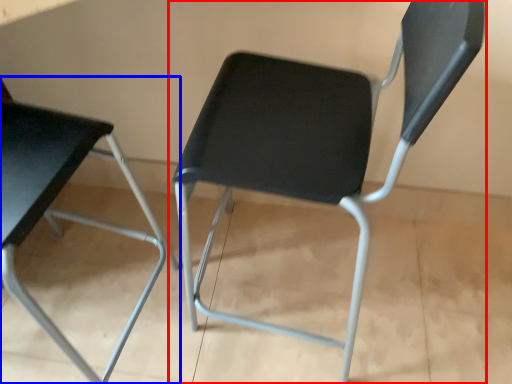
Question: Which of the following is the closest to the observer, chair (highlighted by a red box) or chair (highlighted by a blue box)?

Choices:
 (A) chair
 (B) chair

Answer: (B)